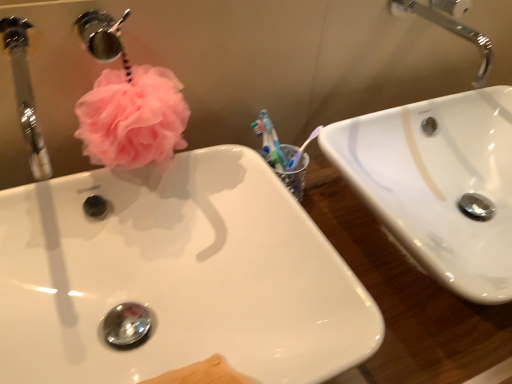
Question: Looking at their shapes, would you say chrome metallic faucet at upper right is wider or thinner than brushed metal faucet at upper left?

Choices:
 (A) wide
 (B) thin

Answer: (B)

Question: Visually, is chrome metallic faucet at upper right positioned to the left or to the right of brushed metal faucet at upper left?

Choices:
 (A) right
 (B) left

Answer: (A)

Question: Considering the real-world distances, which object is farthest from the brushed metal faucet at upper left?

Choices:
 (A) white glossy sink at upper right, the first sink in the right-to-left sequence
 (B) pink fluffy loofah at upper left
 (C) chrome metallic faucet at upper right
 (D) brushed metal faucet at upper left
 (E) white glossy sink at center, which is the 2th sink from right to left

Answer: (D)

Question: Which is farther from the brushed metal faucet at upper left?

Choices:
 (A) chrome metallic faucet at upper right
 (B) white glossy sink at center, the first sink from the left
 (C) brushed metal faucet at upper left
 (D) pink fluffy loofah at upper left
 (E) white glossy sink at upper right, the first sink in the right-to-left sequence

Answer: (C)